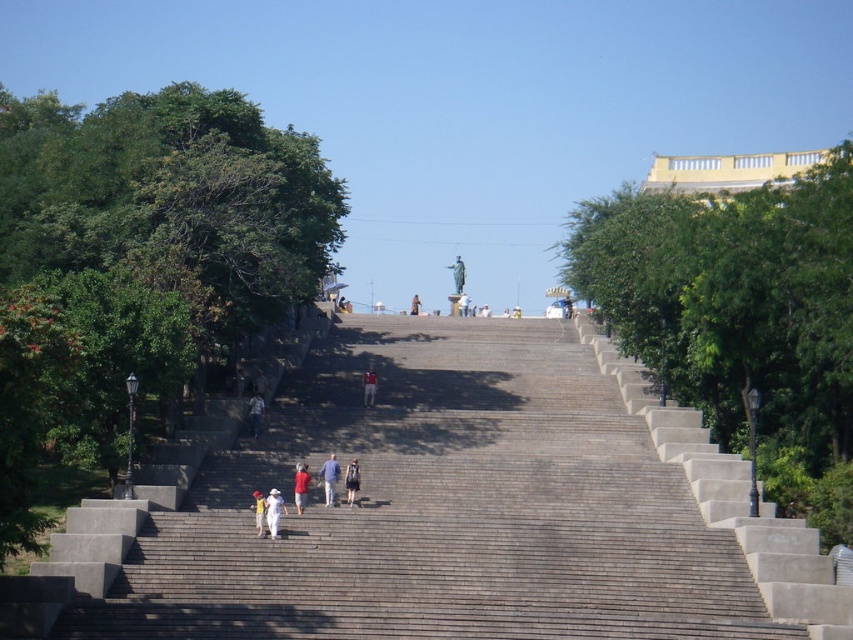
Question: Can you confirm if denim jacket at center is smaller than matte black statue at upper center?

Choices:
 (A) no
 (B) yes

Answer: (B)

Question: Is denim pants at center further to camera compared to red matte shirt at center?

Choices:
 (A) yes
 (B) no

Answer: (A)

Question: Can you confirm if white cotton hat at center is thinner than bronze statue at upper center?

Choices:
 (A) yes
 (B) no

Answer: (A)

Question: Which point is closer to the camera?

Choices:
 (A) bronze statue at upper center
 (B) white matte hat at center
 (C) gray concrete stairs at center
 (D) green leafy tree at right

Answer: (C)

Question: Among these points, which one is farthest from the camera?

Choices:
 (A) [x=773, y=230]
 (B) [x=317, y=476]
 (C) [x=415, y=304]

Answer: (C)

Question: Which object is positioned closest to the white cotton hat at center?

Choices:
 (A) bronze statue at upper center
 (B) denim jacket at center
 (C) red matte shirt at center

Answer: (C)